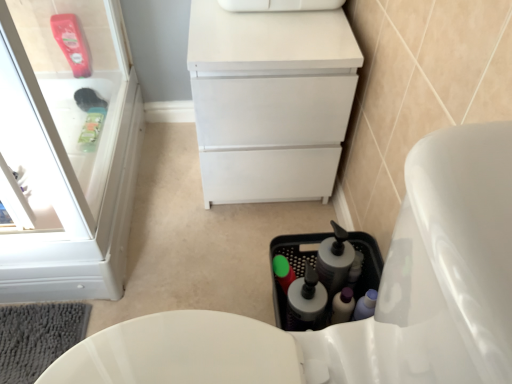
Question: From the image's perspective, is translucent plastic bottle at lower center, the second bottle in the left-to-right sequence, above white plastic cabinet at upper left?

Choices:
 (A) no
 (B) yes

Answer: (A)

Question: Is translucent plastic bottle at lower center, the second bottle in the left-to-right sequence, beside white plastic cabinet at upper left?

Choices:
 (A) no
 (B) yes

Answer: (A)

Question: From the image's perspective, is translucent plastic bottle at lower center, the first bottle in the right-to-left sequence, beneath white plastic cabinet at upper left?

Choices:
 (A) yes
 (B) no

Answer: (A)

Question: Could white plastic cabinet at upper left be considered to be inside translucent plastic bottle at lower center, the second bottle in the left-to-right sequence?

Choices:
 (A) yes
 (B) no

Answer: (B)

Question: Can we say translucent plastic bottle at lower center, the second bottle in the left-to-right sequence, lies outside white plastic cabinet at upper left?

Choices:
 (A) no
 (B) yes

Answer: (B)

Question: Is point (298, 319) closer or farther from the camera than point (280, 279)?

Choices:
 (A) closer
 (B) farther

Answer: (A)

Question: From a real-world perspective, is translucent plastic bottle at lower center, the first bottle in the right-to-left sequence, physically located above or below green matte bottle at center, marked as the 1th bottle in a left-to-right arrangement?

Choices:
 (A) below
 (B) above

Answer: (B)

Question: In terms of size, does translucent plastic bottle at lower center, the second bottle in the left-to-right sequence, appear bigger or smaller than green matte bottle at center, marked as the 1th bottle in a left-to-right arrangement?

Choices:
 (A) big
 (B) small

Answer: (A)

Question: Looking at their shapes, would you say translucent plastic bottle at lower center, the second bottle in the left-to-right sequence, is wider or thinner than green matte bottle at center, marked as the 1th bottle in a left-to-right arrangement?

Choices:
 (A) thin
 (B) wide

Answer: (B)

Question: Is translucent plastic bottle at lower center, the second bottle in the left-to-right sequence, taller or shorter than white plastic cabinet at upper left?

Choices:
 (A) tall
 (B) short

Answer: (B)

Question: Considering the positions of translucent plastic bottle at lower center, the first bottle in the right-to-left sequence, and white plastic cabinet at upper left in the image, is translucent plastic bottle at lower center, the first bottle in the right-to-left sequence, bigger or smaller than white plastic cabinet at upper left?

Choices:
 (A) big
 (B) small

Answer: (B)

Question: In the image, is translucent plastic bottle at lower center, the first bottle in the right-to-left sequence, on the left side or the right side of white plastic cabinet at upper left?

Choices:
 (A) right
 (B) left

Answer: (A)

Question: Considering their positions, is translucent plastic bottle at lower center, the second bottle in the left-to-right sequence, located in front of or behind white plastic cabinet at upper left?

Choices:
 (A) front
 (B) behind

Answer: (B)

Question: From the image's perspective, is white plastic cabinet at upper left above or below white glossy toilet at lower right?

Choices:
 (A) above
 (B) below

Answer: (A)

Question: Considering the relative positions of white plastic cabinet at upper left and white glossy toilet at lower right in the image provided, is white plastic cabinet at upper left to the left or to the right of white glossy toilet at lower right?

Choices:
 (A) left
 (B) right

Answer: (A)